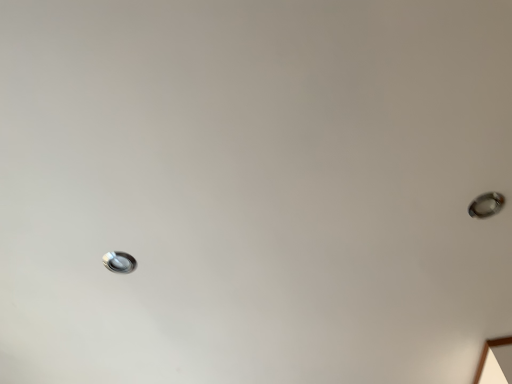
How much space does satin silver droplight at lower left, which is the 2th droplight from front to back, occupy horizontally?

satin silver droplight at lower left, which is the 2th droplight from front to back, is 8.48 centimeters wide.

I want to click on satin silver droplight at lower left, which is the second droplight in right-to-left order, so click(119, 262).

What do you see at coordinates (119, 262) in the screenshot?
I see `satin silver droplight at lower left, acting as the 1th droplight starting from the back` at bounding box center [119, 262].

In order to face satin silver droplight at upper right, which appears as the first droplight when viewed from the top, should I rotate leftwards or rightwards?

Turn right by 28.140 degrees to look at satin silver droplight at upper right, which appears as the first droplight when viewed from the top.

The width and height of the screenshot is (512, 384). I want to click on satin silver droplight at upper right, marked as the 2th droplight in a bottom-to-top arrangement, so click(486, 205).

What do you see at coordinates (486, 205) in the screenshot?
I see `satin silver droplight at upper right, which appears as the first droplight when viewed from the top` at bounding box center [486, 205].

How much space does satin silver droplight at upper right, which is the second droplight from left to right, occupy vertically?

The height of satin silver droplight at upper right, which is the second droplight from left to right, is 0.53 inches.

Where is `satin silver droplight at lower left, the 1th droplight ordered from the bottom`? This screenshot has height=384, width=512. satin silver droplight at lower left, the 1th droplight ordered from the bottom is located at coordinates (119, 262).

Can you confirm if satin silver droplight at lower left, acting as the 1th droplight starting from the back, is positioned to the left of satin silver droplight at upper right, the 2th droplight from the back?

Yes.

Is satin silver droplight at lower left, acting as the 1th droplight starting from the back, positioned before satin silver droplight at upper right, marked as the 2th droplight in a bottom-to-top arrangement?

No, satin silver droplight at lower left, acting as the 1th droplight starting from the back, is further to the viewer.

Which is further, (118,263) or (497,209)?

The point (118,263) is behind.

Looking at this image, from the image's perspective, would you say satin silver droplight at lower left, which is the second droplight from top to bottom, is shown under satin silver droplight at upper right, the 1th droplight viewed from the front?

Yes, from the image's perspective, satin silver droplight at lower left, which is the second droplight from top to bottom, is below satin silver droplight at upper right, the 1th droplight viewed from the front.

From a real-world perspective, which is physically above, satin silver droplight at lower left, which is the 2th droplight from front to back, or satin silver droplight at upper right, marked as the 2th droplight in a bottom-to-top arrangement?

In real-world perspective, satin silver droplight at lower left, which is the 2th droplight from front to back, is above.

Considering the relative sizes of satin silver droplight at lower left, which is the second droplight from top to bottom, and satin silver droplight at upper right, the 1th droplight viewed from the front, in the image provided, is satin silver droplight at lower left, which is the second droplight from top to bottom, thinner than satin silver droplight at upper right, the 1th droplight viewed from the front,?

Yes.

In the scene shown: Considering the sizes of objects satin silver droplight at lower left, placed as the first droplight when sorted from left to right, and satin silver droplight at upper right, marked as the 2th droplight in a bottom-to-top arrangement, in the image provided, who is taller, satin silver droplight at lower left, placed as the first droplight when sorted from left to right, or satin silver droplight at upper right, marked as the 2th droplight in a bottom-to-top arrangement,?

With more height is satin silver droplight at upper right, marked as the 2th droplight in a bottom-to-top arrangement.

Based on the photo, is satin silver droplight at lower left, the 1th droplight ordered from the bottom, bigger than satin silver droplight at upper right, which appears as the first droplight when viewed from the top?

No, satin silver droplight at lower left, the 1th droplight ordered from the bottom, is not bigger than satin silver droplight at upper right, which appears as the first droplight when viewed from the top.

From the picture: Does satin silver droplight at lower left, which is the second droplight in right-to-left order, contain satin silver droplight at upper right, marked as the 1th droplight in a right-to-left arrangement?

No, satin silver droplight at upper right, marked as the 1th droplight in a right-to-left arrangement, is located outside of satin silver droplight at lower left, which is the second droplight in right-to-left order.

Is satin silver droplight at lower left, placed as the first droplight when sorted from left to right, next to satin silver droplight at upper right, which appears as the first droplight when viewed from the top, and touching it?

No.

Is satin silver droplight at lower left, acting as the 1th droplight starting from the back, turned away from satin silver droplight at upper right, the 1th droplight viewed from the front?

No, satin silver droplight at upper right, the 1th droplight viewed from the front, is not at the back of satin silver droplight at lower left, acting as the 1th droplight starting from the back.

Can you tell me how much satin silver droplight at lower left, acting as the 1th droplight starting from the back, and satin silver droplight at upper right, marked as the 2th droplight in a bottom-to-top arrangement, differ in facing direction?

9.23e-05 degrees separate the facing orientations of satin silver droplight at lower left, acting as the 1th droplight starting from the back, and satin silver droplight at upper right, marked as the 2th droplight in a bottom-to-top arrangement.

Locate an element on the screen. The image size is (512, 384). droplight on the right of satin silver droplight at lower left, which is the 2th droplight from front to back is located at coordinates (486, 205).

Between satin silver droplight at upper right, the 1th droplight viewed from the front, and satin silver droplight at lower left, acting as the 1th droplight starting from the back, which one appears on the left side from the viewer's perspective?

satin silver droplight at lower left, acting as the 1th droplight starting from the back.

Considering the relative positions of satin silver droplight at upper right, which appears as the first droplight when viewed from the top, and satin silver droplight at lower left, acting as the 1th droplight starting from the back, in the image provided, is satin silver droplight at upper right, which appears as the first droplight when viewed from the top, behind satin silver droplight at lower left, acting as the 1th droplight starting from the back,?

No, it is not.

Considering the points (495, 193) and (134, 258), which point is behind, point (495, 193) or point (134, 258)?

The point (134, 258) is more distant.

From the image's perspective, who appears lower, satin silver droplight at upper right, marked as the 1th droplight in a right-to-left arrangement, or satin silver droplight at lower left, which is the second droplight from top to bottom?

satin silver droplight at lower left, which is the second droplight from top to bottom, is shown below in the image.

From a real-world perspective, which is physically below, satin silver droplight at upper right, which appears as the first droplight when viewed from the top, or satin silver droplight at lower left, the 1th droplight ordered from the bottom?

satin silver droplight at upper right, which appears as the first droplight when viewed from the top, from a real-world perspective.

Can you confirm if satin silver droplight at upper right, marked as the 1th droplight in a right-to-left arrangement, is thinner than satin silver droplight at lower left, acting as the 1th droplight starting from the back?

In fact, satin silver droplight at upper right, marked as the 1th droplight in a right-to-left arrangement, might be wider than satin silver droplight at lower left, acting as the 1th droplight starting from the back.

Considering the sizes of objects satin silver droplight at upper right, marked as the 2th droplight in a bottom-to-top arrangement, and satin silver droplight at lower left, acting as the 1th droplight starting from the back, in the image provided, who is shorter, satin silver droplight at upper right, marked as the 2th droplight in a bottom-to-top arrangement, or satin silver droplight at lower left, acting as the 1th droplight starting from the back,?

satin silver droplight at lower left, acting as the 1th droplight starting from the back.

Considering the sizes of objects satin silver droplight at upper right, marked as the 2th droplight in a bottom-to-top arrangement, and satin silver droplight at lower left, which is the second droplight from top to bottom, in the image provided, who is bigger, satin silver droplight at upper right, marked as the 2th droplight in a bottom-to-top arrangement, or satin silver droplight at lower left, which is the second droplight from top to bottom,?

satin silver droplight at upper right, marked as the 2th droplight in a bottom-to-top arrangement, is bigger.

In the scene shown: Do you think satin silver droplight at upper right, which is the second droplight from left to right, is within satin silver droplight at lower left, which is the 2th droplight from front to back, or outside of it?

satin silver droplight at upper right, which is the second droplight from left to right, is not enclosed by satin silver droplight at lower left, which is the 2th droplight from front to back.

Is satin silver droplight at upper right, the 1th droplight viewed from the front, not near satin silver droplight at lower left, which is the 2th droplight from front to back?

satin silver droplight at upper right, the 1th droplight viewed from the front, is actually quite close to satin silver droplight at lower left, which is the 2th droplight from front to back.

Could you tell me if satin silver droplight at upper right, the 2th droplight from the back, is facing satin silver droplight at lower left, which is the second droplight from top to bottom?

No, satin silver droplight at upper right, the 2th droplight from the back, is not oriented towards satin silver droplight at lower left, which is the second droplight from top to bottom.

What's the angular difference between satin silver droplight at upper right, which appears as the first droplight when viewed from the top, and satin silver droplight at lower left, the 1th droplight ordered from the bottom,'s facing directions?

satin silver droplight at upper right, which appears as the first droplight when viewed from the top, and satin silver droplight at lower left, the 1th droplight ordered from the bottom, are facing 9.23e-05 degrees away from each other.

I want to click on droplight above the satin silver droplight at upper right, which appears as the first droplight when viewed from the top (from a real-world perspective), so click(119, 262).

The height and width of the screenshot is (384, 512). In order to click on droplight that appears on the right of satin silver droplight at lower left, which is the 2th droplight from front to back in this screenshot , I will do `click(486, 205)`.

Find the location of `droplight below the satin silver droplight at lower left, which is the second droplight in right-to-left order (from a real-world perspective)`. droplight below the satin silver droplight at lower left, which is the second droplight in right-to-left order (from a real-world perspective) is located at coordinates point(486,205).